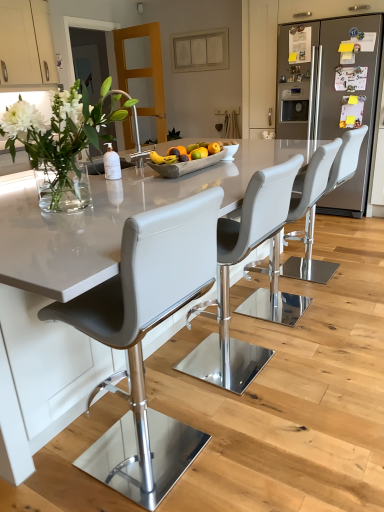
This screenshot has width=384, height=512. Find the location of `vacant space to the right of matte gray chair at center, which ranks as the fourth chair in back-to-front order`. vacant space to the right of matte gray chair at center, which ranks as the fourth chair in back-to-front order is located at coordinates (255, 448).